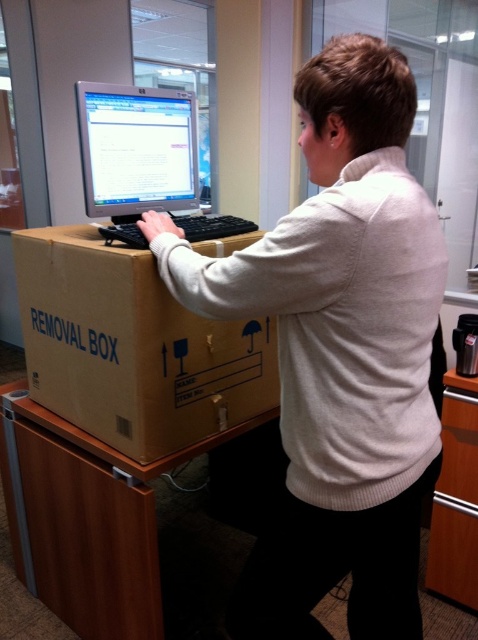
Is point (314, 468) positioned before point (183, 218)?

Yes, point (314, 468) is closer to viewer.

Which is above, white sweater at center or black plastic keyboard at center?

black plastic keyboard at center is higher up.

Find the location of a particular element. white sweater at center is located at coordinates (338, 353).

Can you confirm if white sweater at center is bigger than brown wood/file cabinet at lower right?

Correct, white sweater at center is larger in size than brown wood/file cabinet at lower right.

In the scene shown: Does white sweater at center have a greater height compared to brown wood/file cabinet at lower right?

Yes.

Locate an element on the screen. The image size is (478, 640). white sweater at center is located at coordinates (338, 353).

Does matte black monitor at center have a greater width compared to brown wood/file cabinet at lower right?

Yes, matte black monitor at center is wider than brown wood/file cabinet at lower right.

Does matte black monitor at center have a lesser width compared to brown wood/file cabinet at lower right?

Incorrect, matte black monitor at center's width is not less than brown wood/file cabinet at lower right's.

Who is more distant from viewer, (154, 108) or (449, 397)?

Positioned behind is point (449, 397).

The image size is (478, 640). Identify the location of matte black monitor at center. (143, 161).